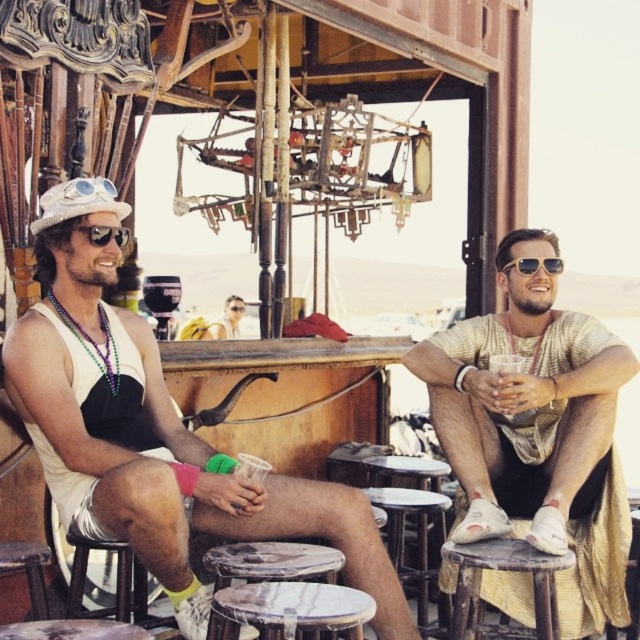
Does point (234, 337) lie in front of point (508, 264)?

No.

Is matte black sunglasses at center to the right of gold metallic sunglasses at right from the viewer's perspective?

Incorrect, matte black sunglasses at center is not on the right side of gold metallic sunglasses at right.

Who is more distant from viewer, (227, 328) or (545, 259)?

The point (227, 328) is more distant.

This screenshot has width=640, height=640. Find the location of `matte black sunglasses at center`. matte black sunglasses at center is located at coordinates (227, 321).

Which is behind, point (536, 428) or point (506, 538)?

The point (536, 428) is more distant.

Find the location of a particular element. matte gold shirt at center is located at coordinates (525, 403).

Where is `matte gold shirt at center`? The height and width of the screenshot is (640, 640). matte gold shirt at center is located at coordinates (525, 403).

From the picture: Is matte black goggles at left bigger than gold metallic sunglasses at right?

Actually, matte black goggles at left might be smaller than gold metallic sunglasses at right.

Does matte black goggles at left have a greater height compared to gold metallic sunglasses at right?

Incorrect, matte black goggles at left's height is not larger of gold metallic sunglasses at right's.

I want to click on matte black goggles at left, so click(104, 234).